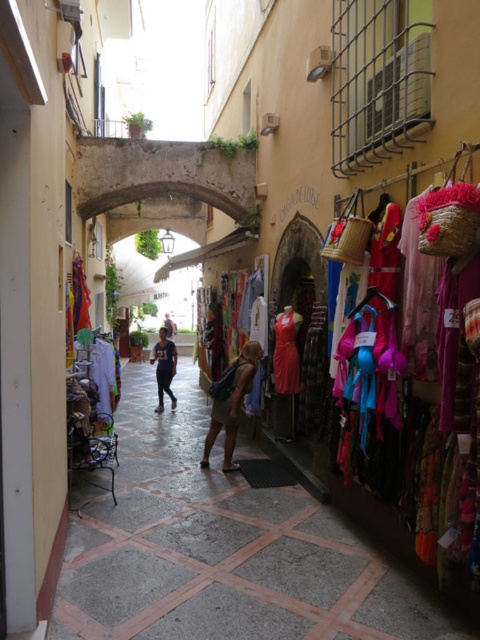
You are a customer in this street scene and want to examine both the blue fabric dress at center and the dark blue fabric at center. Which one should you approach first to get a closer look?

You should approach the blue fabric dress at center first because it is closer to you than the dark blue fabric at center.